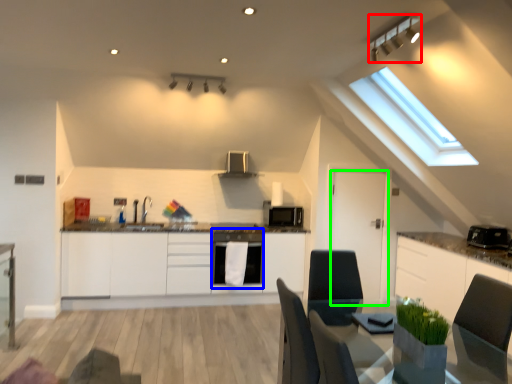
Question: Which object is the farthest from light fixture (highlighted by a red box)? Choose among these: dish washer (highlighted by a blue box) or door (highlighted by a green box).

Choices:
 (A) dish washer
 (B) door

Answer: (A)